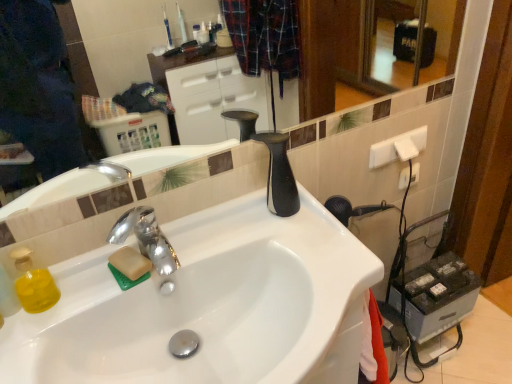
Image resolution: width=512 pixels, height=384 pixels. Identify the location of vacant area that lies to the right of chrome metallic faucet at center. (223, 247).